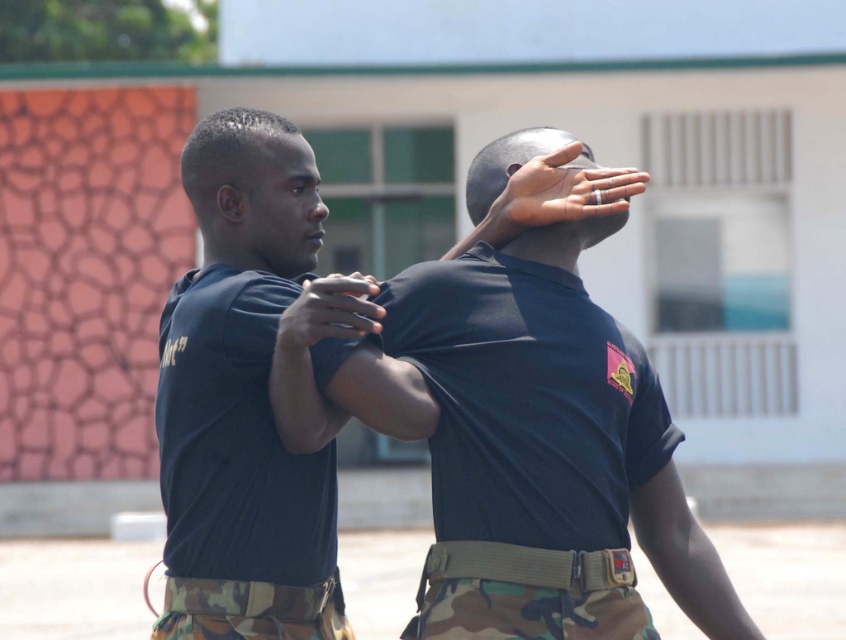
Question: Which point is farther to the camera?

Choices:
 (A) (567, 188)
 (B) (332, 531)
 (C) (253, 620)
 (D) (416, 275)

Answer: (B)

Question: Observing the image, what is the correct spatial positioning of camo fabric belt at lower center in reference to silver metallic ring at upper center?

Choices:
 (A) left
 (B) right

Answer: (A)

Question: Can you confirm if black matte shirt at center is smaller than silver metallic ring at upper center?

Choices:
 (A) no
 (B) yes

Answer: (A)

Question: Among these points, which one is nearest to the camera?

Choices:
 (A) (514, 168)
 (B) (330, 304)
 (C) (177, 600)
 (D) (190, 618)

Answer: (B)

Question: Is black matte shirt at center positioned behind matte black hand at center?

Choices:
 (A) no
 (B) yes

Answer: (B)

Question: Considering the real-world distances, which object is closest to the navy blue t-shirt at center?

Choices:
 (A) silver metallic ring at upper center
 (B) camo fabric belt at lower center
 (C) black matte shirt at center
 (D) matte black hand at center

Answer: (B)